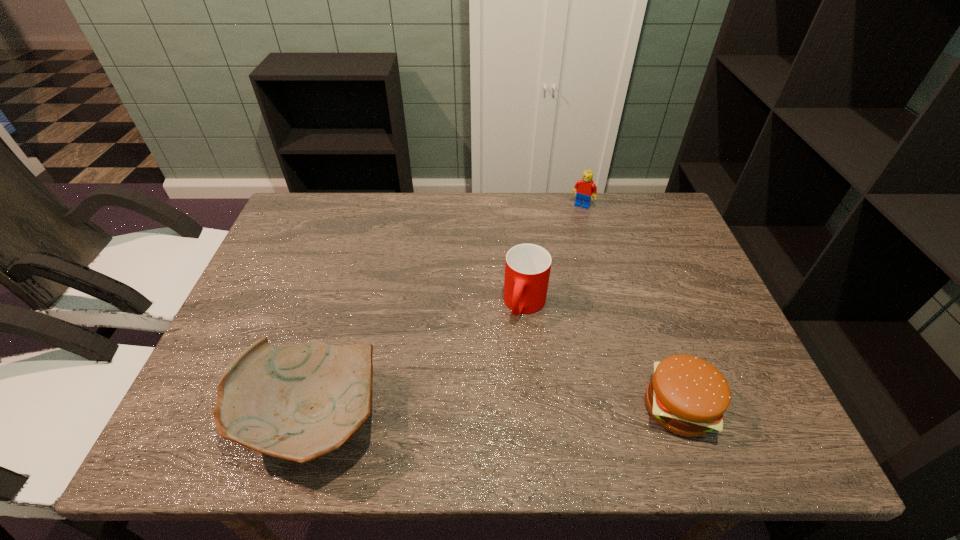
The image size is (960, 540). Identify the location of pottery. (299, 403).

Find the location of a particular element. The image size is (960, 540). hamburger is located at coordinates (688, 396).

Find the location of a particular element. The height and width of the screenshot is (540, 960). the third nearest object is located at coordinates (527, 266).

This screenshot has height=540, width=960. I want to click on cup, so click(527, 266).

This screenshot has height=540, width=960. In order to click on the farthest object in this screenshot , I will do `click(584, 188)`.

Find the location of `free location located 0.140m on the back of the leftmost object`. free location located 0.140m on the back of the leftmost object is located at coordinates (341, 315).

Where is `vacant region located 0.060m on the right of the hamburger`? This screenshot has width=960, height=540. vacant region located 0.060m on the right of the hamburger is located at coordinates (745, 407).

This screenshot has width=960, height=540. I want to click on free location located on the side of the third object from right to left with the handle, so click(504, 361).

You are a GUI agent. You are given a task and a screenshot of the screen. Output one action in this format:
    pyautogui.click(x=<x>, y=<y>)
    Task: Click on the vacant area located 0.200m on the side of the third object from right to left with the handle
    This screenshot has height=540, width=960.
    Given the screenshot: What is the action you would take?
    pyautogui.click(x=490, y=394)

What are the coordinates of `vacant space located 0.090m on the side of the third object from right to left with the handle` in the screenshot? It's located at (507, 354).